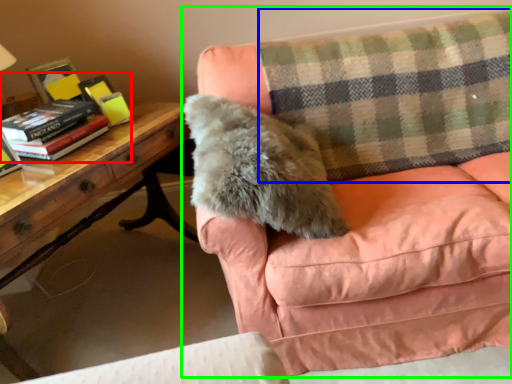
Question: Which is nearer to the book (highlighted by a red box)? plaid (highlighted by a blue box) or studio couch (highlighted by a green box).

Choices:
 (A) plaid
 (B) studio couch

Answer: (B)